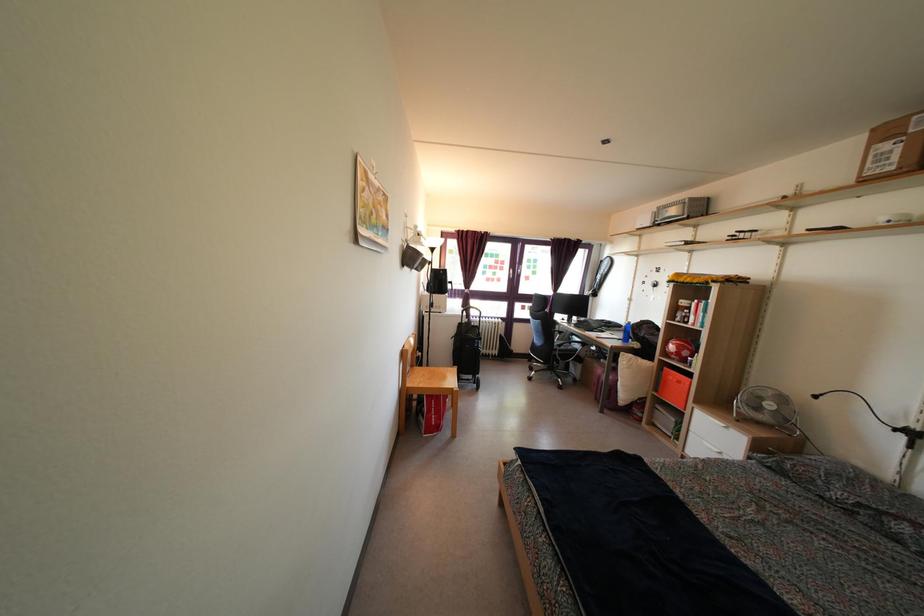
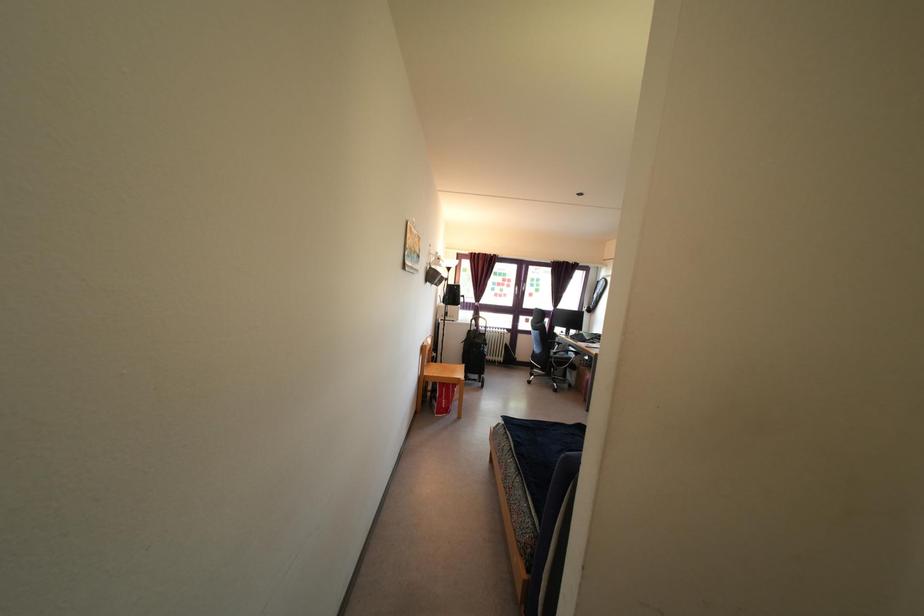
Find the pixel in the second image that matches (x=563, y=354) in the first image.

(557, 362)